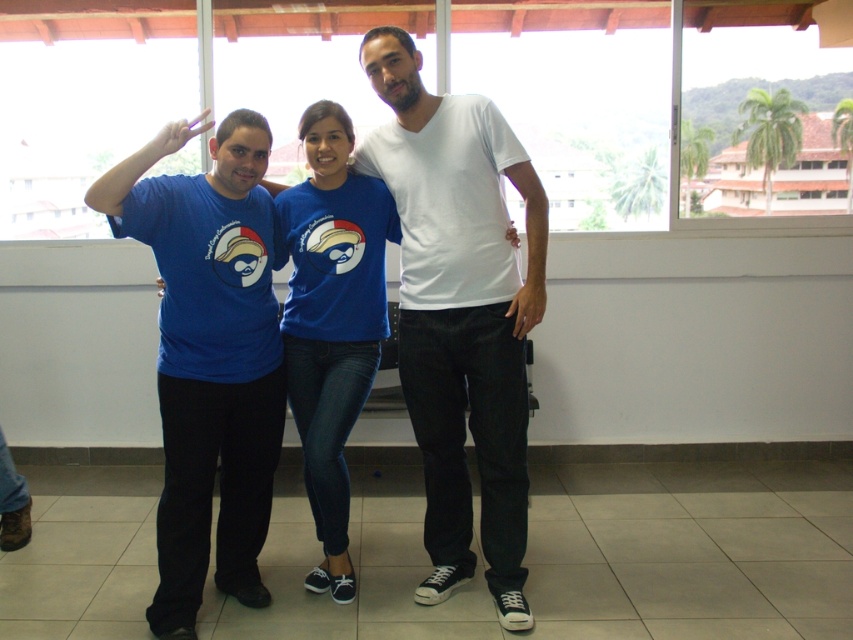
Question: Does matte blue t-shirt at left have a lesser width compared to blue cotton shirt at center?

Choices:
 (A) yes
 (B) no

Answer: (B)

Question: Which point is farther from the camera taking this photo?

Choices:
 (A) (160, 324)
 (B) (492, 113)
 (C) (339, 387)

Answer: (C)

Question: Does matte blue t-shirt at left have a lesser width compared to blue cotton shirt at center?

Choices:
 (A) no
 (B) yes

Answer: (A)

Question: In this image, where is white matte t-shirt at center located relative to matte blue t-shirt at left?

Choices:
 (A) right
 (B) left

Answer: (A)

Question: Which object appears farthest from the camera in this image?

Choices:
 (A) blue cotton shirt at center
 (B) matte blue t-shirt at left

Answer: (A)

Question: Among these points, which one is nearest to the camera?

Choices:
 (A) (230, 131)
 (B) (291, 314)
 (C) (508, 428)

Answer: (A)